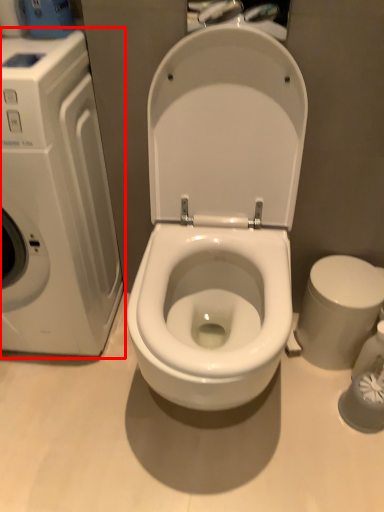
Question: From the image, what is the correct spatial relationship of washing machine (annotated by the red box) in relation to bidet?

Choices:
 (A) right
 (B) left

Answer: (B)